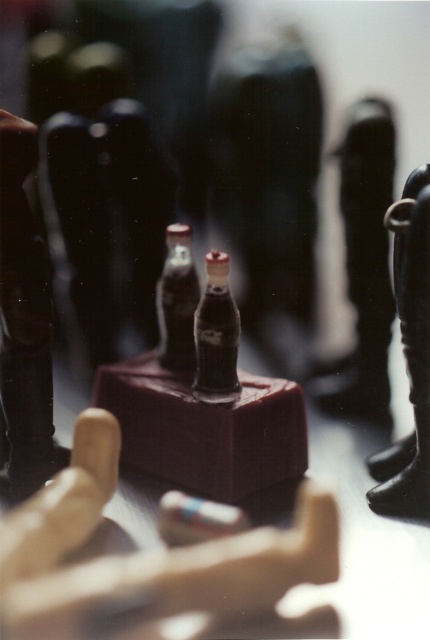
Question: Does shiny dark glass bottle at center have a larger size compared to matte glass bottle at center?

Choices:
 (A) yes
 (B) no

Answer: (A)

Question: From the image, what is the correct spatial relationship of black rubber boot at right in relation to matte glass bottle at center?

Choices:
 (A) right
 (B) left

Answer: (A)

Question: Which object is farther from the camera taking this photo?

Choices:
 (A) shiny plastic bottles at center
 (B) black rubber boot at right
 (C) matte glass bottle at center
 (D) shiny dark glass bottle at center

Answer: (C)

Question: Which of the following is the farthest from the observer?

Choices:
 (A) (220, 388)
 (B) (177, 307)
 (C) (420, 424)

Answer: (B)

Question: Among these points, which one is nearest to the camera?

Choices:
 (A) click(242, 440)
 (B) click(233, 326)
 (C) click(415, 344)
 (D) click(183, 300)

Answer: (C)

Question: Considering the relative positions of black rubber boot at right and matte glass bottle at center in the image provided, where is black rubber boot at right located with respect to matte glass bottle at center?

Choices:
 (A) above
 (B) below

Answer: (B)